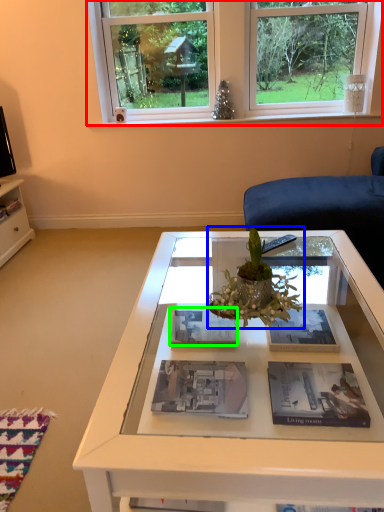
Question: Which object is positioned closest to window (highlighted by a red box)? Select from houseplant (highlighted by a blue box) and magazine (highlighted by a green box).

Choices:
 (A) houseplant
 (B) magazine

Answer: (B)